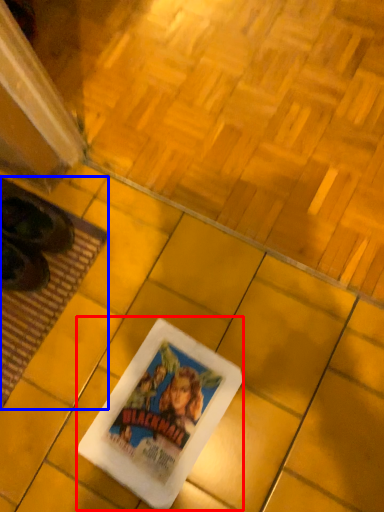
Question: Among these objects, which one is farthest to the camera, movie poster (highlighted by a red box) or mat (highlighted by a blue box)?

Choices:
 (A) movie poster
 (B) mat

Answer: (B)